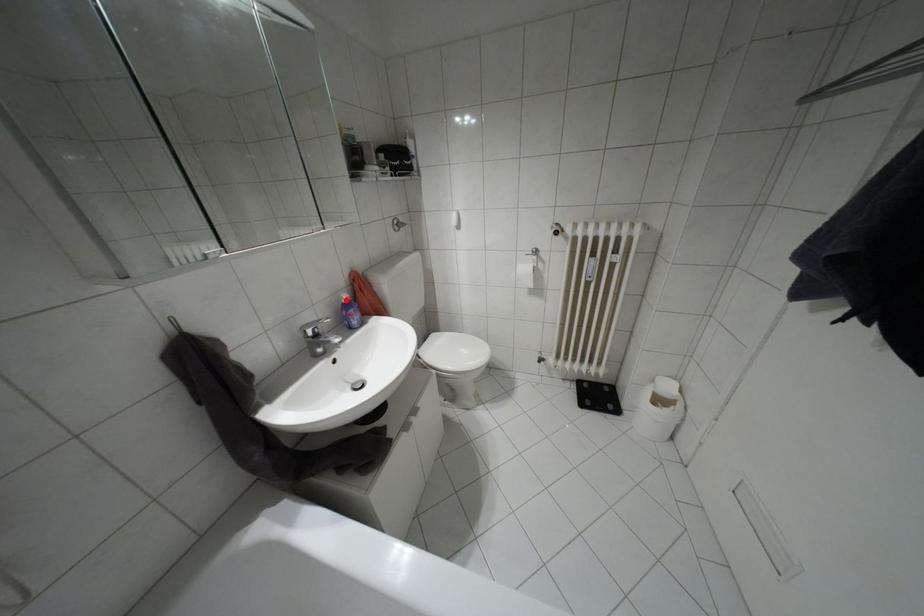
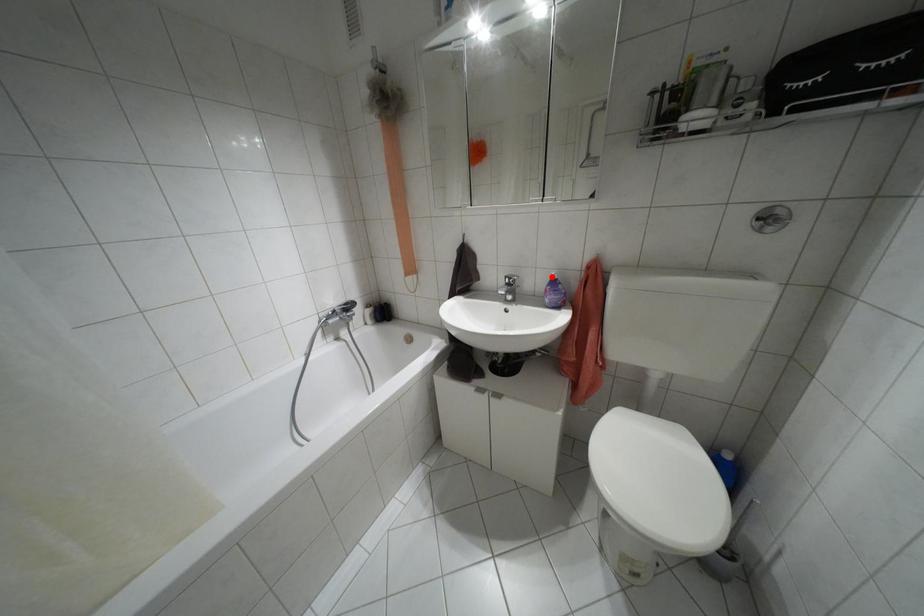
I am providing you with two images of the same scene from different viewpoints. A red point is marked on the first image and another point is marked on the second image. Are the points marked in image1 and image2 representing the same 3D position?

Yes